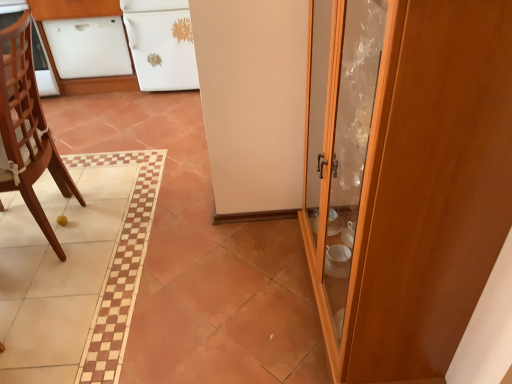
Question: Considering the positions of wooden chair at left and wooden cabinet at right in the image, is wooden chair at left wider or thinner than wooden cabinet at right?

Choices:
 (A) thin
 (B) wide

Answer: (B)

Question: Considering their positions, is wooden chair at left located in front of or behind wooden cabinet at right?

Choices:
 (A) front
 (B) behind

Answer: (B)

Question: Considering the real-world distances, which object is closest to the wooden cabinet at right?

Choices:
 (A) white glossy cabinet at upper left, acting as the first cabinetry starting from the right
 (B) white glossy dishwasher at upper left, acting as the 1th cabinetry starting from the left
 (C) wooden chair at left

Answer: (C)

Question: Considering the real-world distances, which object is farthest from the white glossy dishwasher at upper left, acting as the 1th cabinetry starting from the left?

Choices:
 (A) wooden chair at left
 (B) white glossy cabinet at upper left, the 2th cabinetry when ordered from left to right
 (C) wooden cabinet at right

Answer: (C)